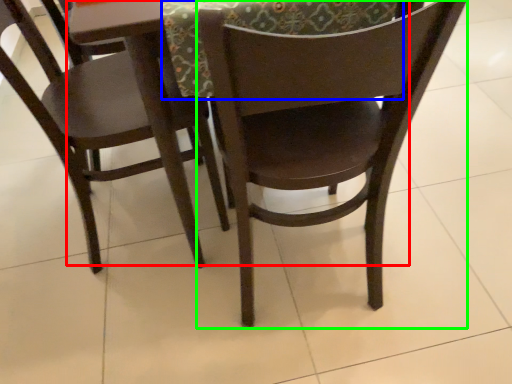
Question: Which object is positioned closest to round table (highlighted by a red box)? Select from tablecloth (highlighted by a blue box) and chair (highlighted by a green box).

Choices:
 (A) tablecloth
 (B) chair

Answer: (A)